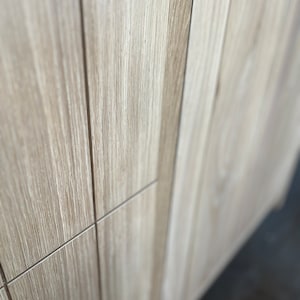
At what (x,y) coordinates should I click in order to perform the action: click on foot of the furniture. Please return your answer as a coordinate pair (x, y). Looking at the image, I should click on (283, 204).